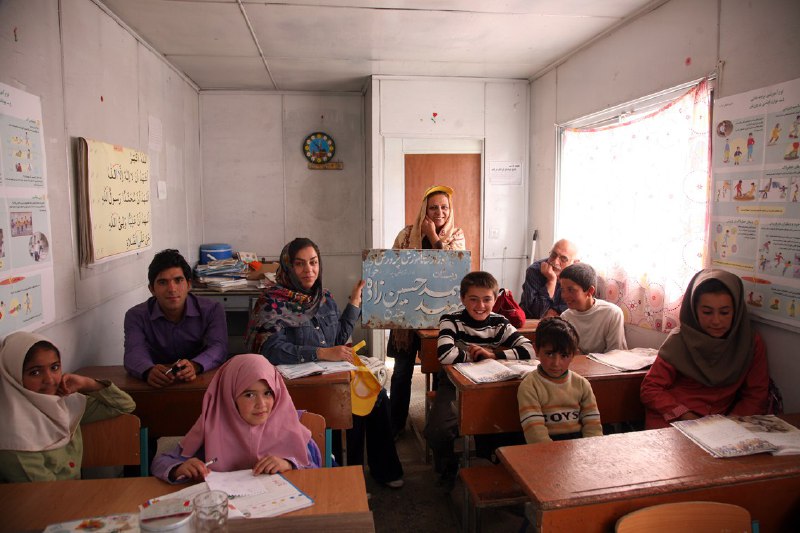
This screenshot has height=533, width=800. Identify the location of door. (442, 166).